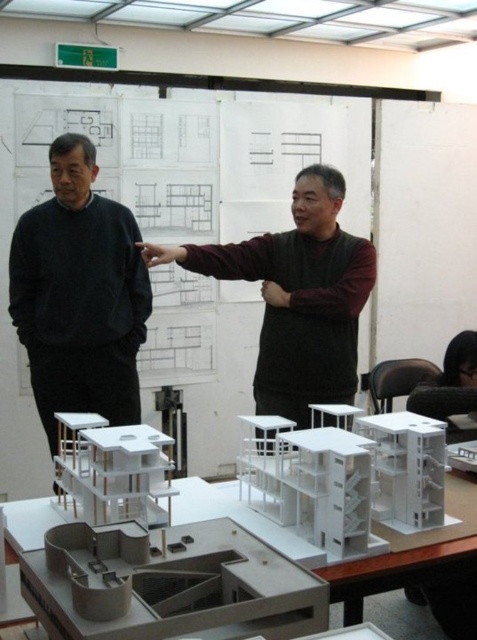
Is dark brown sweater at center positioned behind white matte table at center?

Yes, it is behind white matte table at center.

Is point (165, 246) positioned before point (52, 512)?

No.

Identify the location of dark brown sweater at center. (298, 296).

Between point (111, 204) and point (390, 554), which one is positioned in front?

Point (390, 554) is more forward.

Which is behind, point (91, 179) or point (201, 506)?

Positioned behind is point (91, 179).

Is point (94, 152) closer to camera compared to point (401, 561)?

No.

Image resolution: width=477 pixels, height=640 pixels. In order to click on black matte sweater at left in this screenshot , I will do `click(80, 294)`.

Which is behind, point (53, 397) or point (345, 362)?

The point (53, 397) is more distant.

Which is more to the left, black matte sweater at left or dark brown sweater at center?

black matte sweater at left

Which is in front, point (52, 211) or point (352, 257)?

Point (352, 257)

Find the location of `black matte sweater at left`. black matte sweater at left is located at coordinates (80, 294).